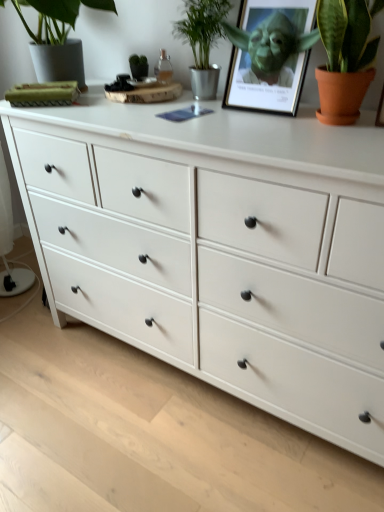
Question: From a real-world perspective, is matte green picture frame at upper center physically located above or below terracotta clay pot at upper right, acting as the first houseplant starting from the right?

Choices:
 (A) below
 (B) above

Answer: (A)

Question: Is matte green picture frame at upper center bigger or smaller than terracotta clay pot at upper right, the third houseplant in the left-to-right sequence?

Choices:
 (A) small
 (B) big

Answer: (B)

Question: Which is farther from the green matte plant at upper left, the 1th houseplant positioned from the left?

Choices:
 (A) terracotta clay pot at upper right, the third houseplant in the left-to-right sequence
 (B) matte green picture frame at upper center
 (C) green metallic plant at upper center, the 2th houseplant positioned from the left

Answer: (A)

Question: Which of these objects is positioned farthest from the green metallic plant at upper center, the 2th houseplant positioned from the left?

Choices:
 (A) green matte plant at upper left, the 1th houseplant positioned from the left
 (B) matte green picture frame at upper center
 (C) terracotta clay pot at upper right, acting as the first houseplant starting from the right

Answer: (C)